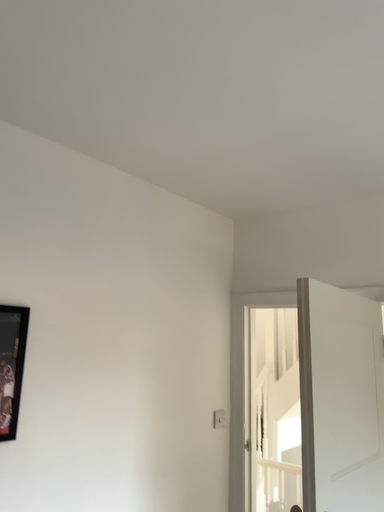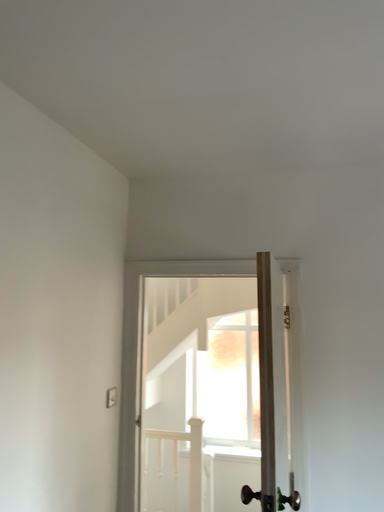
Question: How did the camera likely rotate when shooting the video?

Choices:
 (A) rotated downward
 (B) rotated upward

Answer: (A)